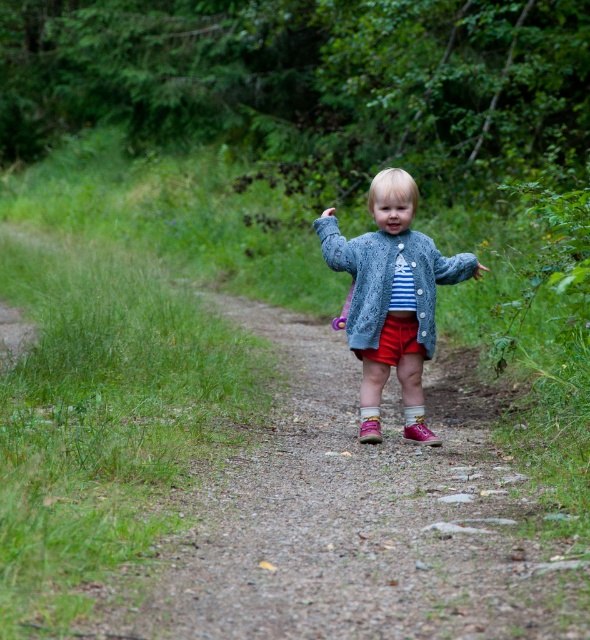
You are a photographer trying to capture both the knitted blue sweater at center and the denim jacket at center in the same frame. Given that your camera has a focal length of 50mm and a sensor size of 24x36mm, can you estimate whether the two items are within the camera sensor width when positioned at a distance of 10 meters?

The distance between knitted blue sweater at center and denim jacket at center is 3.64 inches. At 10 meters, this distance corresponds to an angle of view of approximately 0.2 degrees. The sensor width of 36mm at 50mm focal length covers about 62.5 degrees. Since 0.2 degrees is much smaller than 62.5 degrees, both items would easily fit within the camera sensor width.